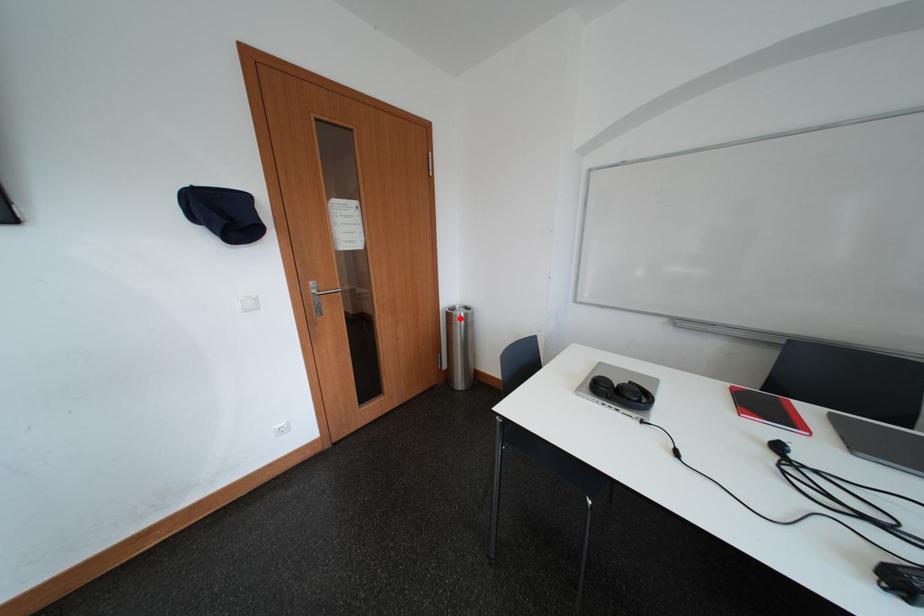
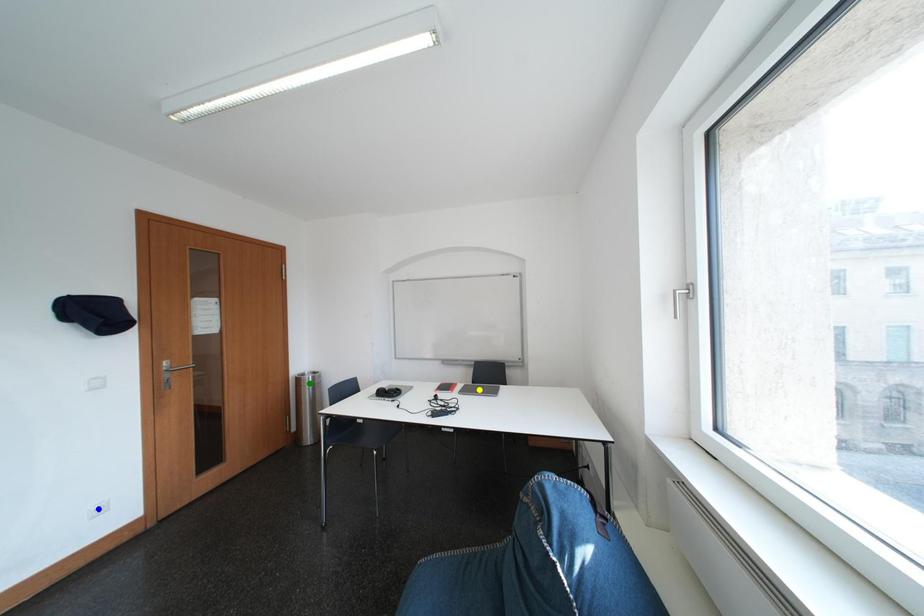
Question: I am providing you with two images of the same scene from different viewpoints. A red point is marked on the first image. You are given multiple points on the second image. Which point in image 2 is actually the same real-world point as the red point in image 1?

Choices:
 (A) green point
 (B) yellow point
 (C) blue point

Answer: (A)